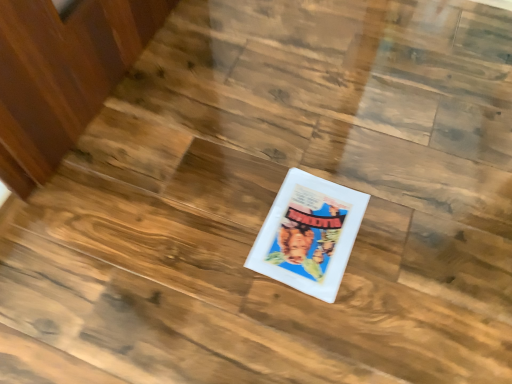
Find the location of `white glossy book at center`. white glossy book at center is located at coordinates (309, 234).

What do you see at coordinates (309, 234) in the screenshot? This screenshot has height=384, width=512. I see `white glossy book at center` at bounding box center [309, 234].

Where is `white glossy book at center`? The width and height of the screenshot is (512, 384). white glossy book at center is located at coordinates (309, 234).